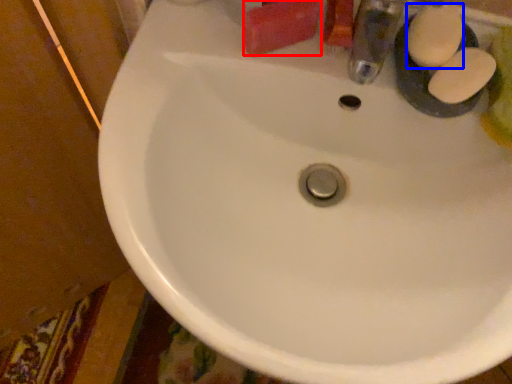
Question: Which object appears closest to the camera in this image, soap (highlighted by a red box) or soap (highlighted by a blue box)?

Choices:
 (A) soap
 (B) soap

Answer: (B)